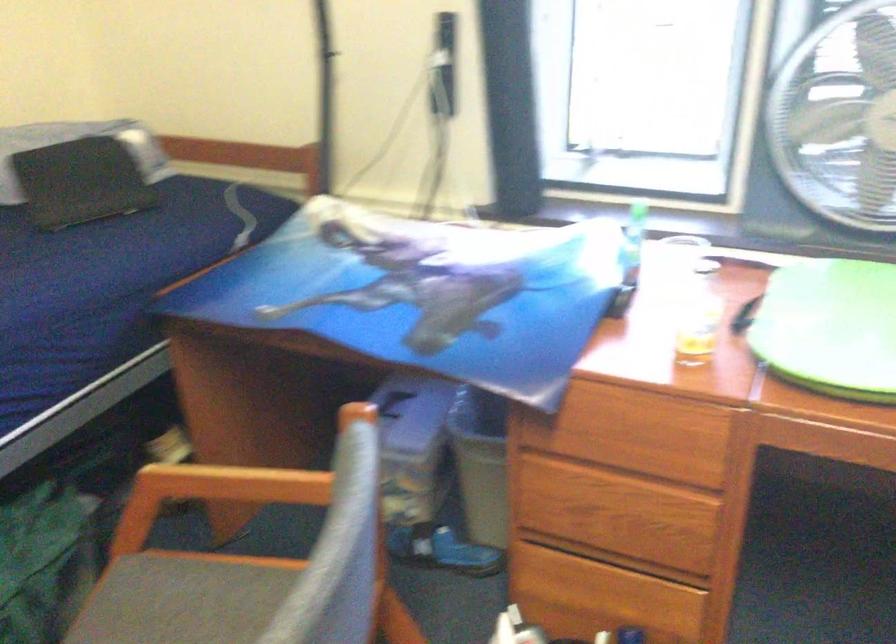
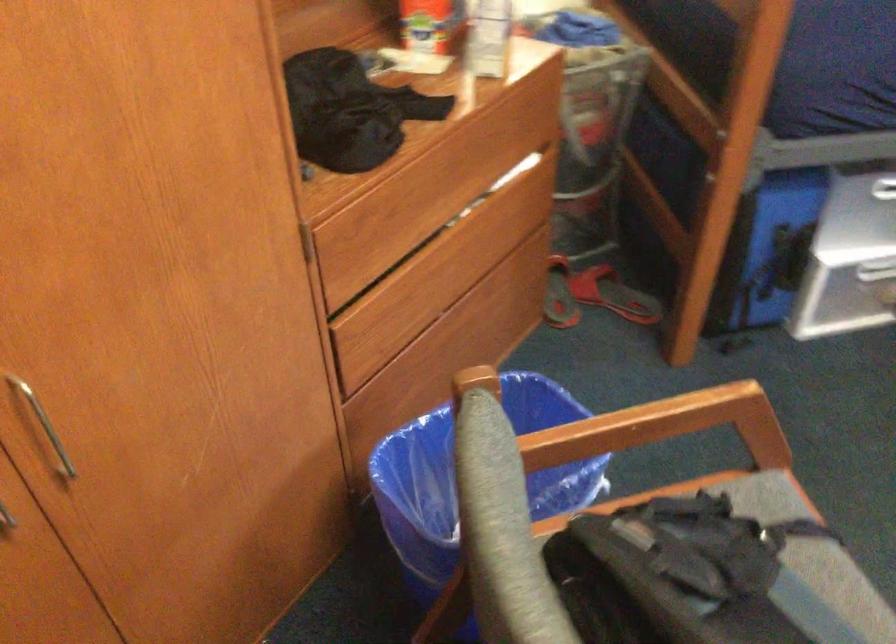
The first image is from the beginning of the video and the second image is from the end. How did the camera likely rotate when shooting the video?

The camera's rotation is toward left-down.